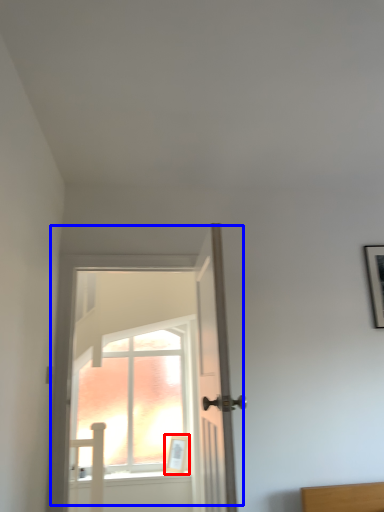
Question: Among these objects, which one is farthest to the camera, picture frame (highlighted by a red box) or door (highlighted by a blue box)?

Choices:
 (A) picture frame
 (B) door

Answer: (A)